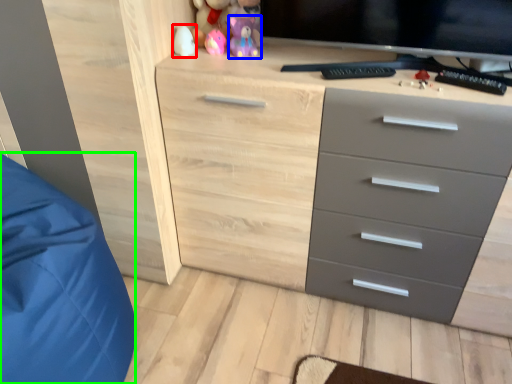
Question: Which is farther away from toy (highlighted by a red box)? toy (highlighted by a blue box) or sleeping bag (highlighted by a green box)?

Choices:
 (A) toy
 (B) sleeping bag

Answer: (B)